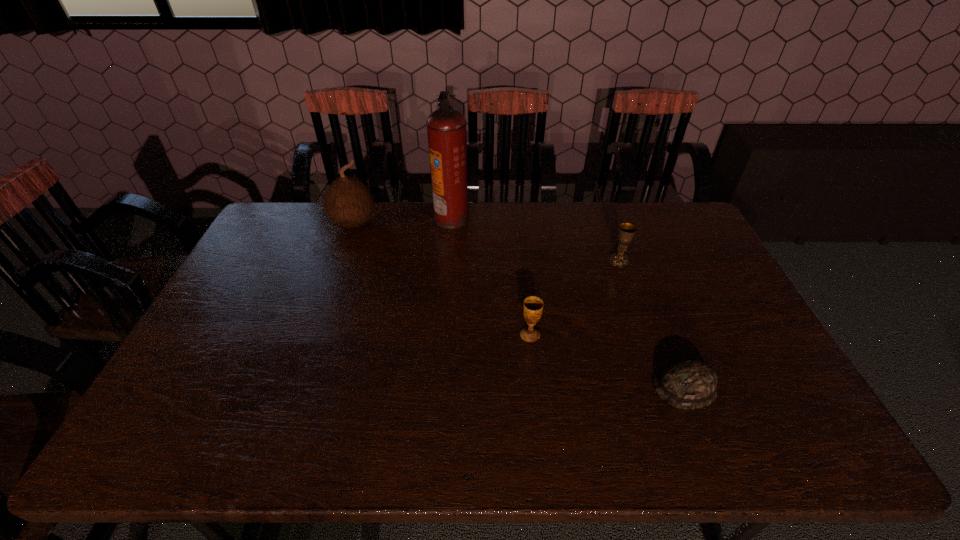
You are a GUI agent. You are given a task and a screenshot of the screen. Output one action in this format:
    pyautogui.click(x=<x>, y=<y>)
    Task: Click on the vacant space located 0.390m at the nozzle of the tallest object
    The height and width of the screenshot is (540, 960).
    Given the screenshot: What is the action you would take?
    pyautogui.click(x=574, y=218)

What are the coordinates of `blank space located 0.370m on the surface of the second tallest object` in the screenshot? It's located at (322, 315).

The height and width of the screenshot is (540, 960). In order to click on vacant position located 0.260m on the front of the third farthest object in this screenshot , I will do `click(643, 328)`.

This screenshot has height=540, width=960. What are the coordinates of `free space located 0.360m on the right of the left chalice` in the screenshot? It's located at (669, 335).

The image size is (960, 540). What are the coordinates of `free space located 0.060m on the front of the shortest object` in the screenshot? It's located at (703, 434).

Find the location of a particular element. fire extinguisher located at the far edge is located at coordinates (446, 127).

In order to click on coconut at the far edge in this screenshot , I will do `click(348, 201)`.

I want to click on vacant space at the far edge of the desktop, so pyautogui.click(x=633, y=203).

Where is `free location at the near edge`? The width and height of the screenshot is (960, 540). free location at the near edge is located at coordinates (668, 435).

What are the coordinates of `vacant area at the left edge` in the screenshot? It's located at (209, 384).